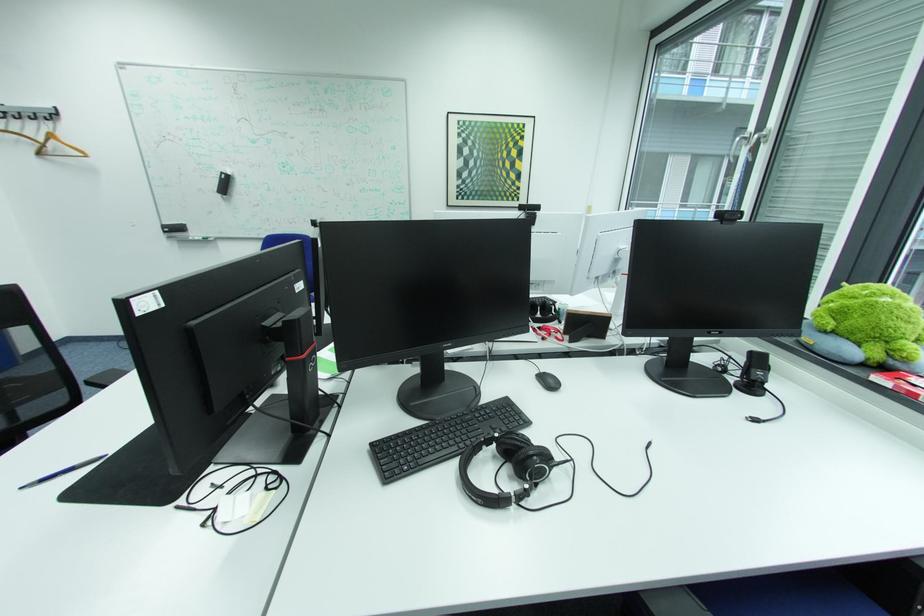
The location [507,468] corresponds to which object?

It refers to a black headphones.